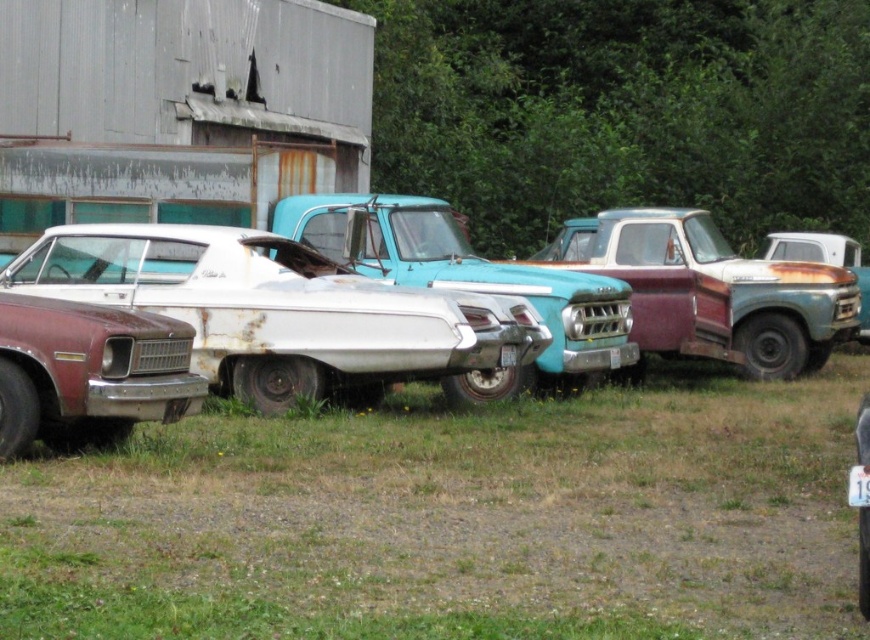
Question: Can you confirm if rusty matte white car at center is positioned above rusty metal pickup truck at center?

Choices:
 (A) no
 (B) yes

Answer: (A)

Question: Which point is closer to the camera?

Choices:
 (A) green grass at lower center
 (B) white matte pickup truck at center
 (C) rusty matte white car at center

Answer: (A)

Question: Which object appears farthest from the camera in this image?

Choices:
 (A) rusty metal pickup truck at center
 (B) rusty metallic sedan at lower left
 (C) rusty matte white car at center
 (D) white matte pickup truck at center

Answer: (A)

Question: Does rusty matte white car at center have a larger size compared to white matte pickup truck at center?

Choices:
 (A) yes
 (B) no

Answer: (B)

Question: Which of the following is the closest to the observer?

Choices:
 (A) rusty metallic sedan at lower left
 (B) rusty metal pickup truck at center
 (C) green grass at lower center

Answer: (C)

Question: Considering the relative positions of rusty metallic sedan at lower left and white matte pickup truck at center in the image provided, where is rusty metallic sedan at lower left located with respect to white matte pickup truck at center?

Choices:
 (A) below
 (B) above

Answer: (A)